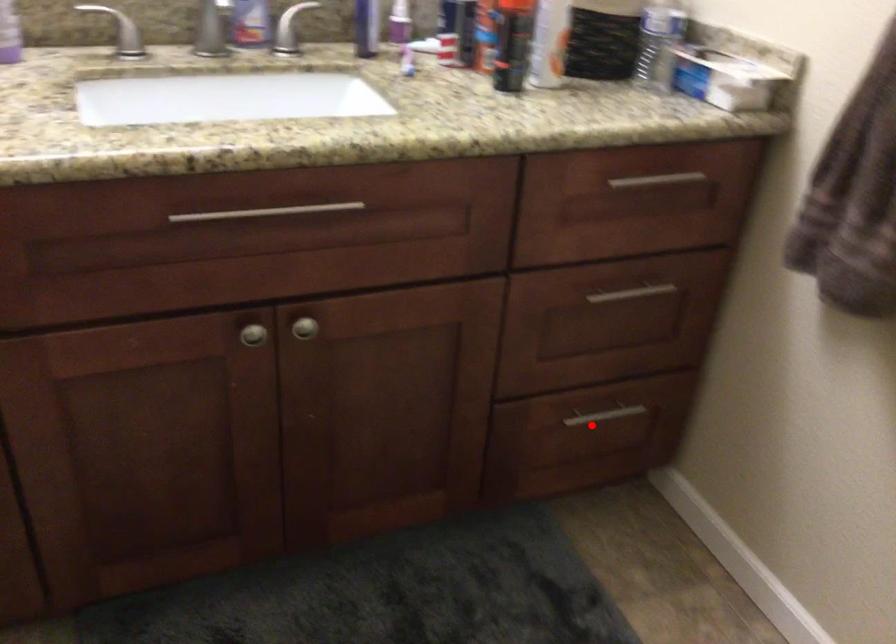
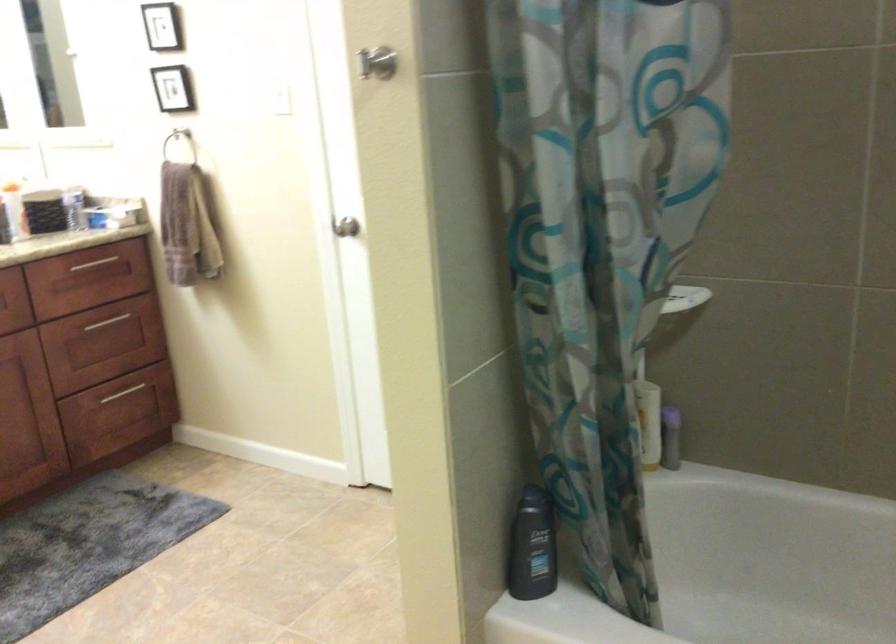
Question: I am providing you with two images of the same scene from different viewpoints. Image1 has a red point marked. In image2, the corresponding 3D location appears at what relative position? Reply with the corresponding letter.

Choices:
 (A) Closer
 (B) Farther

Answer: (B)